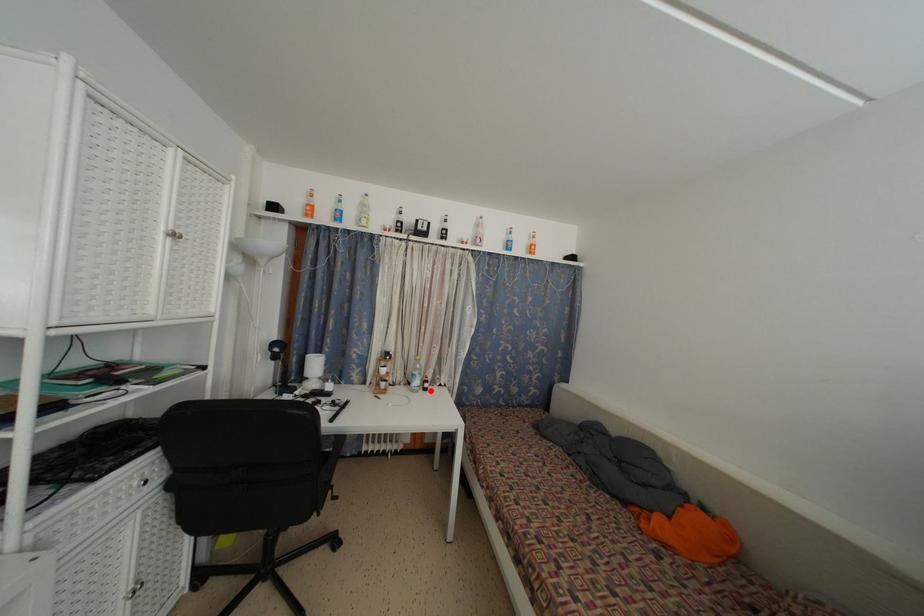
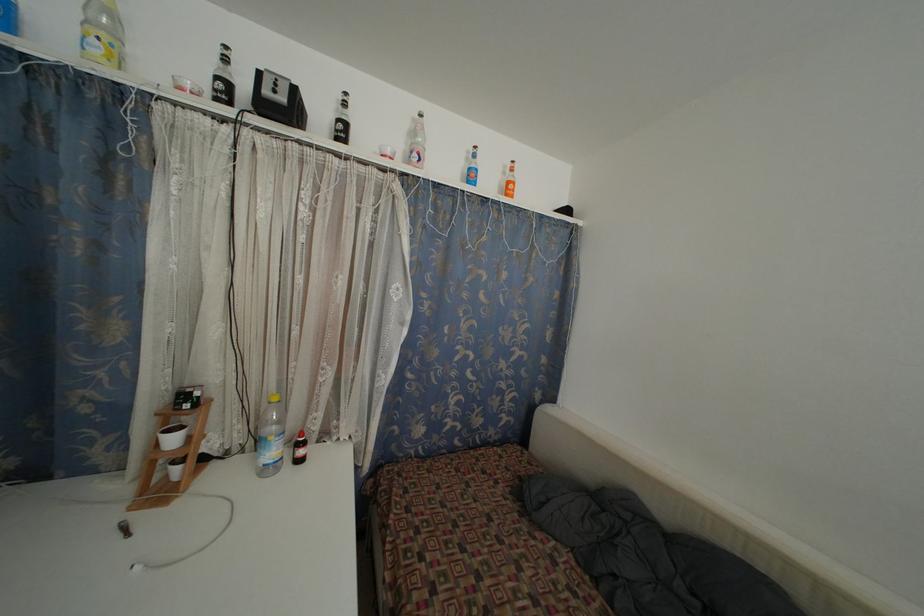
Locate, in the second image, the point that corresponds to the highlighted location in the first image.

(305, 458)